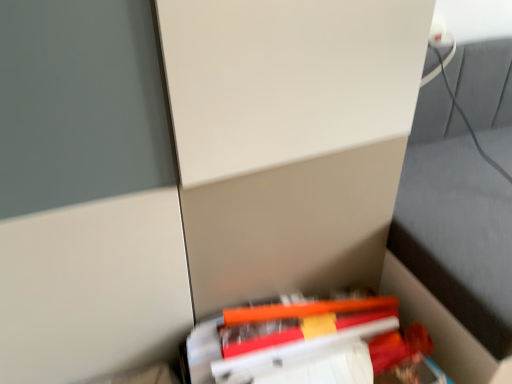
Question: In terms of width, does orange matte book at lower center look wider or thinner when compared to orange matte pencil at lower center?

Choices:
 (A) wide
 (B) thin

Answer: (A)

Question: Does point tap(365, 334) appear closer or farther from the camera than point tap(330, 329)?

Choices:
 (A) closer
 (B) farther

Answer: (B)

Question: From the image's perspective, is orange matte book at lower center positioned above or below orange matte pencil at lower center?

Choices:
 (A) above
 (B) below

Answer: (B)

Question: From a real-world perspective, is orange matte pencil at lower center physically located above or below orange matte book at lower center?

Choices:
 (A) above
 (B) below

Answer: (A)

Question: From the image's perspective, is orange matte pencil at lower center positioned above or below orange matte book at lower center?

Choices:
 (A) above
 (B) below

Answer: (A)

Question: Is orange matte pencil at lower center to the left or to the right of orange matte book at lower center in the image?

Choices:
 (A) left
 (B) right

Answer: (B)

Question: Considering the positions of point (249, 332) and point (224, 336), is point (249, 332) closer or farther from the camera than point (224, 336)?

Choices:
 (A) closer
 (B) farther

Answer: (B)